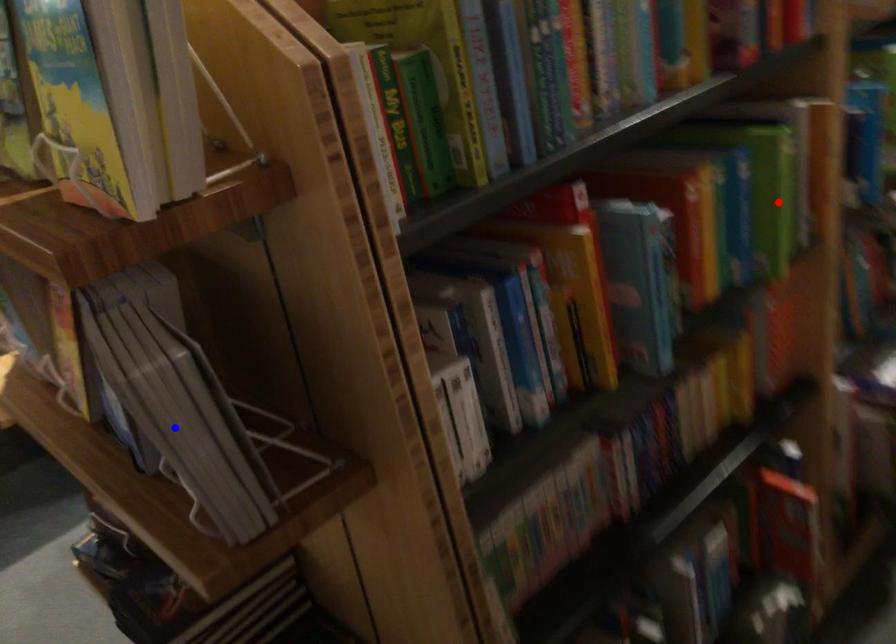
Question: Which of the two points in the image is closer to the camera?

Choices:
 (A) Blue point is closer.
 (B) Red point is closer.

Answer: (A)